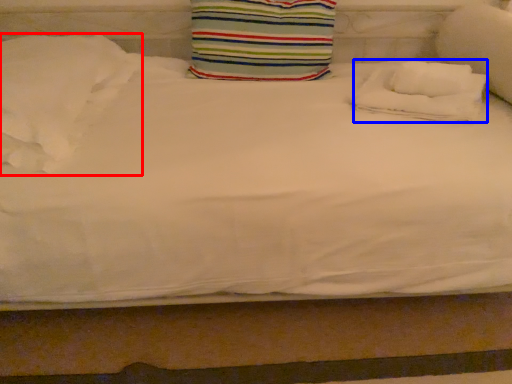
Question: Which of the following is the closest to the observer, pillow (highlighted by a red box) or pillow (highlighted by a blue box)?

Choices:
 (A) pillow
 (B) pillow

Answer: (A)